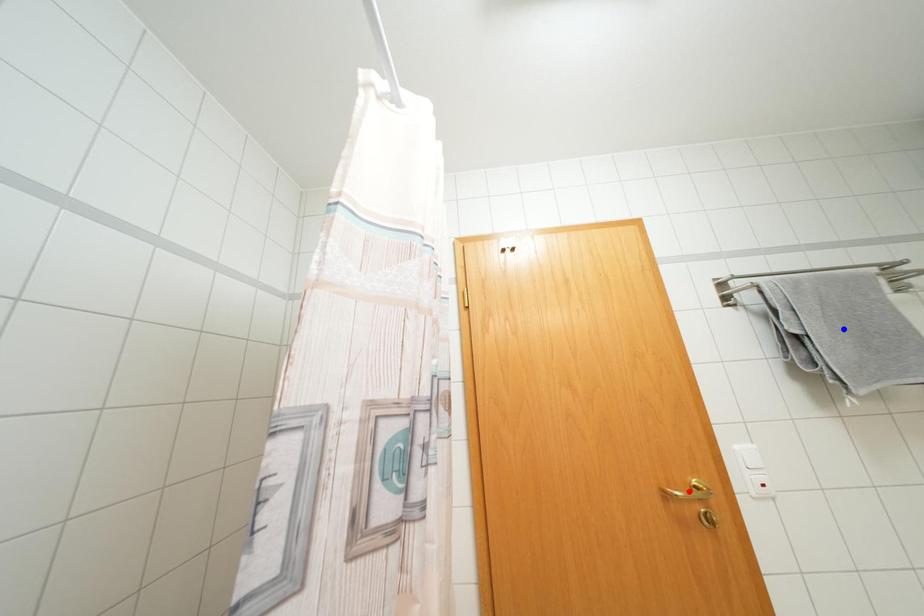
Question: In the image, two points are highlighted. Which point is nearer to the camera? Reply with the corresponding letter.

Choices:
 (A) blue point
 (B) red point

Answer: (B)